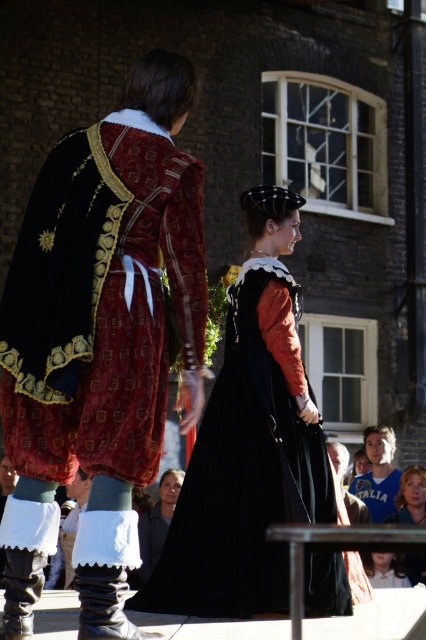
Question: Which point is closer to the camera?

Choices:
 (A) (161, 483)
 (B) (400, 476)
 (C) (363, 572)

Answer: (C)

Question: Which of these objects is positioned closest to the matte black dress at lower center?

Choices:
 (A) black satin dress at center
 (B) smooth brown hair at lower right

Answer: (A)

Question: Does matte black coat at center appear on the left side of smooth brown hair at lower right?

Choices:
 (A) yes
 (B) no

Answer: (A)

Question: Is blue jersey at lower right positioned behind smooth brown hair at lower right?

Choices:
 (A) no
 (B) yes

Answer: (B)

Question: Which of these objects is positioned farthest from the velvet brocade robe at center?

Choices:
 (A) black satin dress at center
 (B) smooth brown hair at lower right

Answer: (B)

Question: Is blue jersey at lower right positioned at the back of matte black dress at lower center?

Choices:
 (A) yes
 (B) no

Answer: (A)